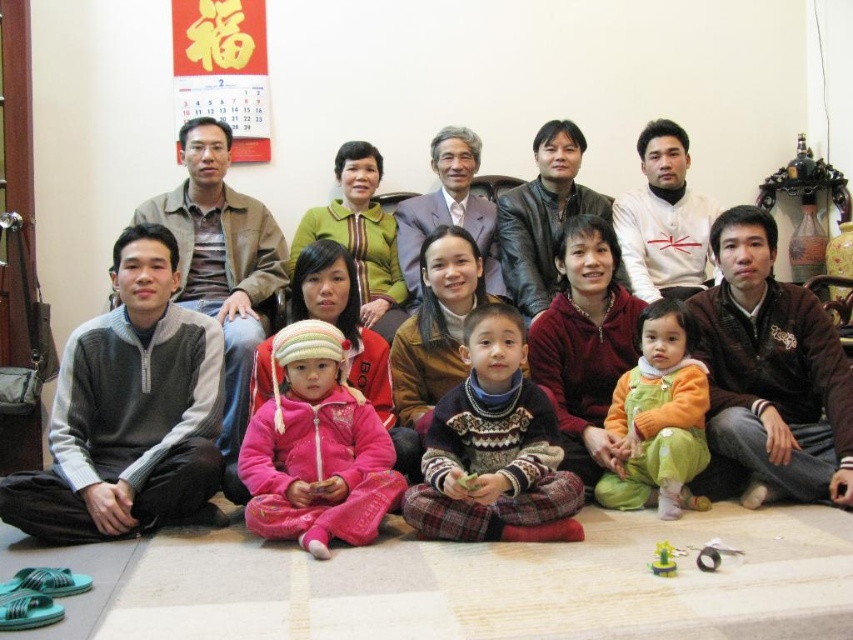
Can you confirm if pink fleece jacket at center is shorter than green plastic toy at lower center?

A: No.

Which of these two, pink fleece jacket at center or green plastic toy at lower center, stands shorter?

Standing shorter between the two is green plastic toy at lower center.

Does point (244, 422) come in front of point (660, 541)?

No.

Identify the location of pink fleece jacket at center. (222, 268).

Between point (271, 516) and point (717, 544), which one is positioned in front?

Point (717, 544) is more forward.

Is point (334, 461) farther from camera compared to point (709, 554)?

Yes, point (334, 461) is farther from viewer.

Does point (299, 509) come closer to viewer compared to point (701, 564)?

No.

This screenshot has width=853, height=640. In order to click on pink fleece jacket at lower left in this screenshot , I will do `click(316, 449)`.

Is pink fleece jacket at center positioned behind knitted sweater at center?

Yes, pink fleece jacket at center is further from the viewer.

Who is higher up, pink fleece jacket at center or knitted sweater at center?

pink fleece jacket at center

Does point (33, 524) lie behind point (469, 481)?

Yes, point (33, 524) is farther from viewer.

Identify the location of pink fleece jacket at center. The width and height of the screenshot is (853, 640). (222, 268).